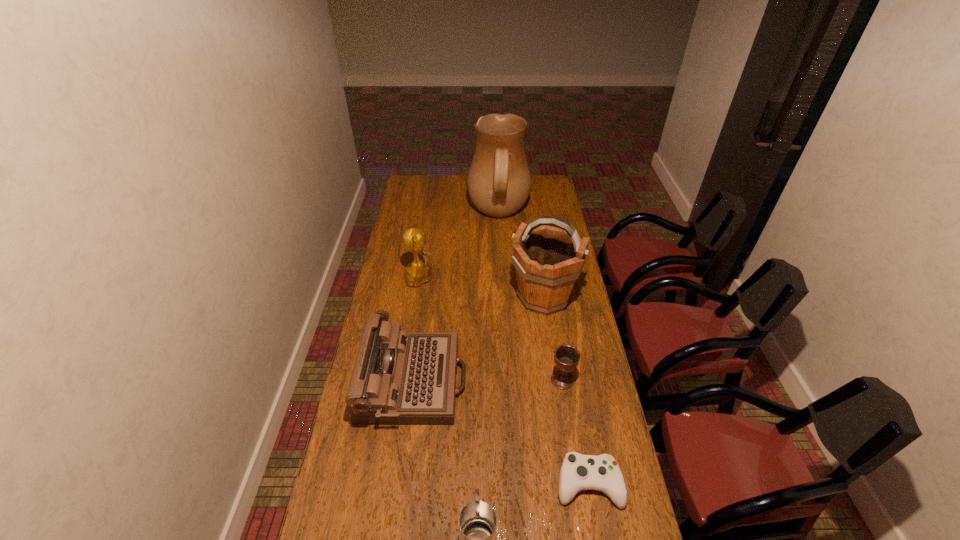
At what (x,y) coordinates should I click in order to perform the action: click on cream pitcher. Please return your answer as a coordinate pair (x, y). The width and height of the screenshot is (960, 540). Looking at the image, I should click on (499, 181).

The image size is (960, 540). I want to click on bucket, so click(x=548, y=260).

This screenshot has height=540, width=960. In order to click on award in this screenshot , I will do `click(418, 272)`.

This screenshot has height=540, width=960. Find the location of `the fourth shortest object`. the fourth shortest object is located at coordinates (399, 377).

Locate an element on the screen. Image resolution: width=960 pixels, height=540 pixels. chalice is located at coordinates (566, 357).

This screenshot has width=960, height=540. Identify the location of control. (578, 472).

Where is `free space located at the spout of the farthest object`? free space located at the spout of the farthest object is located at coordinates (422, 215).

You are a GUI agent. You are given a task and a screenshot of the screen. Output one action in this format:
    pyautogui.click(x=<x>, y=<y>)
    Task: Click on the vacant space positioned at the spout of the farthest object
    Image resolution: width=960 pixels, height=540 pixels.
    Given the screenshot: What is the action you would take?
    pyautogui.click(x=400, y=215)

Find the location of a particular element. Image resolution: width=960 pixels, height=540 pixels. free space located at the spout of the farthest object is located at coordinates (451, 215).

You are a GUI agent. You are given a task and a screenshot of the screen. Output one action in this format:
    pyautogui.click(x=<x>, y=<y>)
    Task: Click on the free space located 0.100m on the back of the sixth shortest object
    This screenshot has height=540, width=960.
    Given the screenshot: What is the action you would take?
    pyautogui.click(x=538, y=261)